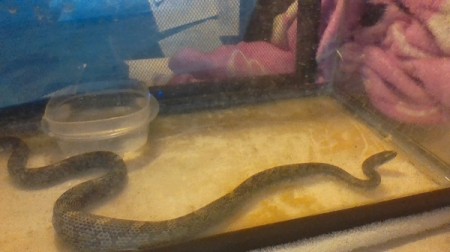
I want to click on pink blanket, so click(x=390, y=55).